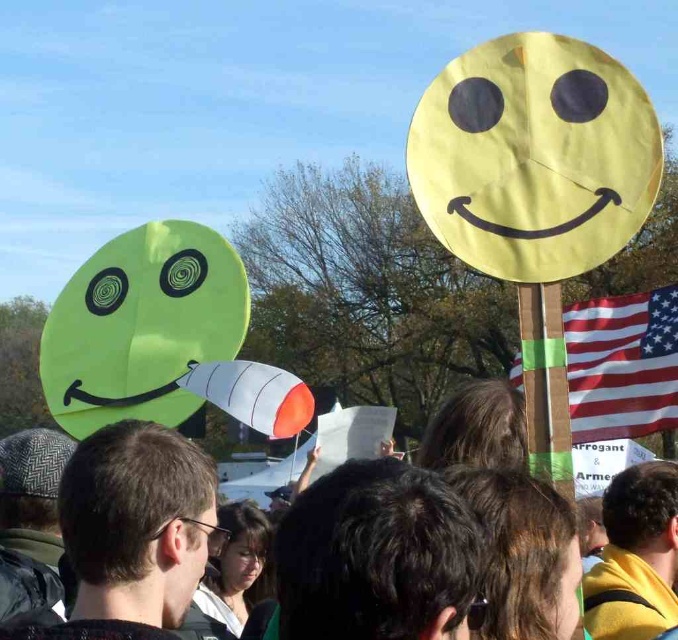
Question: Is american flag at right below smooth skin face at center?

Choices:
 (A) yes
 (B) no

Answer: (B)

Question: Which is nearer to the smooth brown hair at center?

Choices:
 (A) american flag at right
 (B) yellow fabric head at upper center
 (C) matte green smiley face at upper left

Answer: (B)

Question: Which of the following is the closest to the observer?

Choices:
 (A) (47, 483)
 (B) (656, 424)
 (C) (195, 624)
 (D) (633, 476)

Answer: (A)

Question: Is yellow fabric head at upper center bigger than matte black hair at center?

Choices:
 (A) no
 (B) yes

Answer: (A)

Question: Which of the following is the closest to the observer?

Choices:
 (A) matte black hair at center
 (B) dark brown hair at center
 (C) smooth brown hair at center
 (D) matte green smiley face at upper left

Answer: (B)

Question: Is dark brown hair at center in front of american flag at right?

Choices:
 (A) yes
 (B) no

Answer: (A)